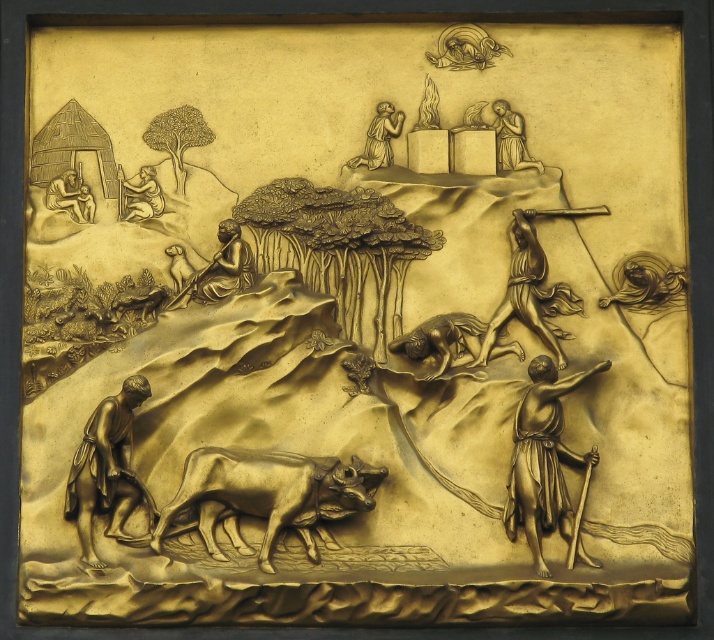
Is gold textured oxen at center smaller than gold textured figure at upper left?

Indeed, gold textured oxen at center has a smaller size compared to gold textured figure at upper left.

Is point (266, 557) more distant than point (140, 186)?

No, it is not.

Does point (246, 484) come in front of point (154, 195)?

That is True.

This screenshot has width=714, height=640. What are the coordinates of `gold textured oxen at center` in the screenshot? It's located at [266, 496].

Between bronze figure at center and gold textured cow at center, which one is positioned higher?

bronze figure at center

Does bronze figure at center have a greater height compared to gold textured cow at center?

Yes, bronze figure at center is taller than gold textured cow at center.

Is point (523, 305) positioned after point (423, 378)?

Yes, point (523, 305) is behind point (423, 378).

You are a GUI agent. You are given a task and a screenshot of the screen. Output one action in this format:
    pyautogui.click(x=<x>, y=<y>)
    Task: Click on the bronze figure at center
    
    Given the screenshot: What is the action you would take?
    pyautogui.click(x=531, y=292)

Is gold relief figure at upper right thinner than gold textured figure at upper left?

In fact, gold relief figure at upper right might be wider than gold textured figure at upper left.

Between point (501, 116) and point (134, 188), which one is positioned in front?

Point (134, 188) is more forward.

Find the location of `gold relief figure at upper right`. gold relief figure at upper right is located at coordinates (511, 138).